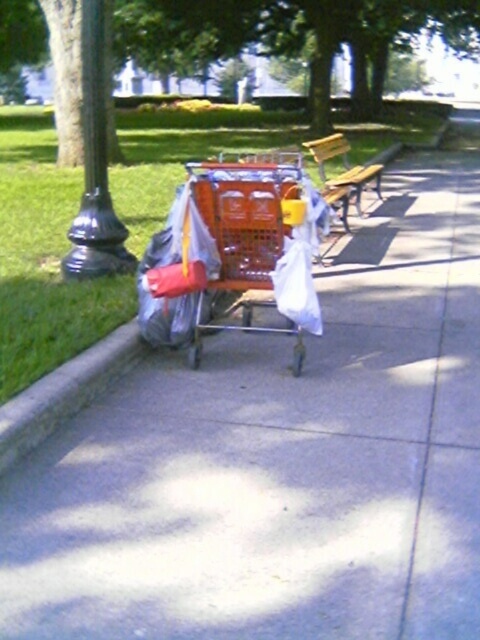
Does orange plastic shopping cart at center appear over wooden bench at center?

No, orange plastic shopping cart at center is not above wooden bench at center.

Which is below, orange plastic shopping cart at center or wooden bench at center?

orange plastic shopping cart at center is below.

Identify the location of orange plastic shopping cart at center. This screenshot has width=480, height=640. (247, 236).

I want to click on orange plastic shopping cart at center, so click(x=247, y=236).